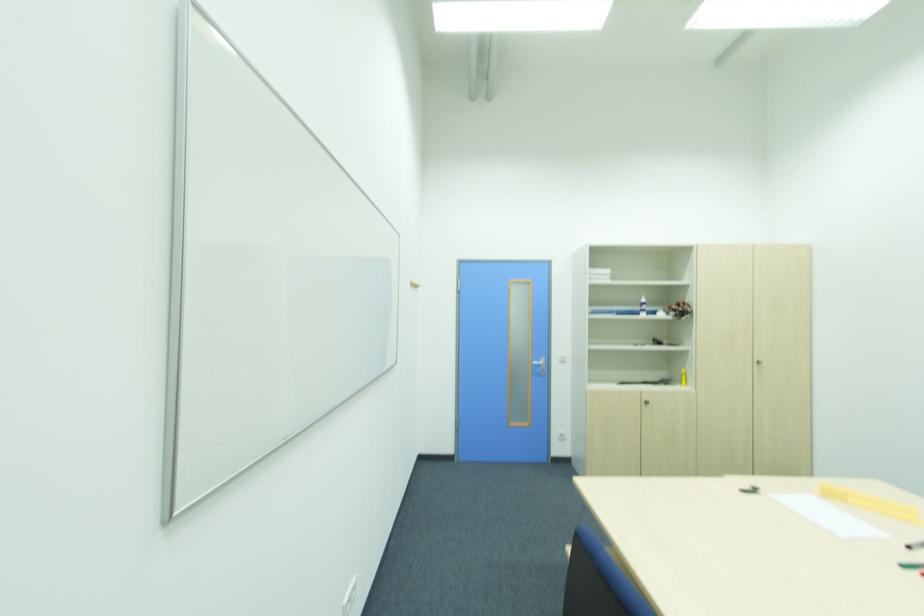
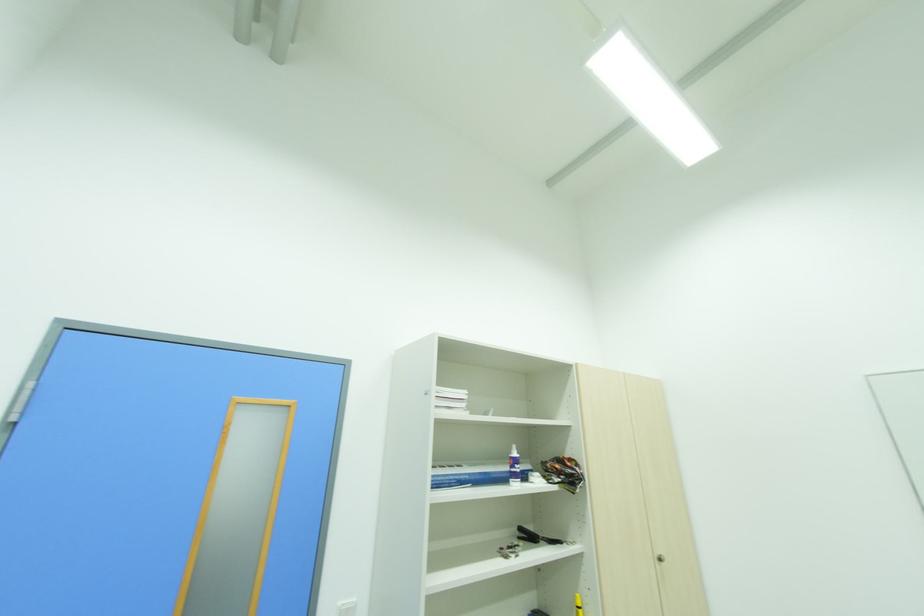
Locate, in the second image, the point that corresponds to point 662,344 in the first image.

(536, 539)